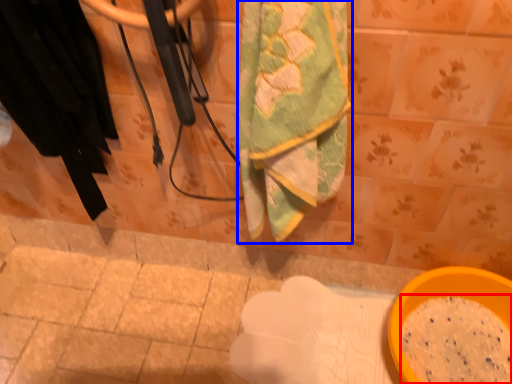
Question: Among these objects, which one is nearest to the camera, powder (highlighted by a red box) or towel (highlighted by a blue box)?

Choices:
 (A) powder
 (B) towel

Answer: (B)